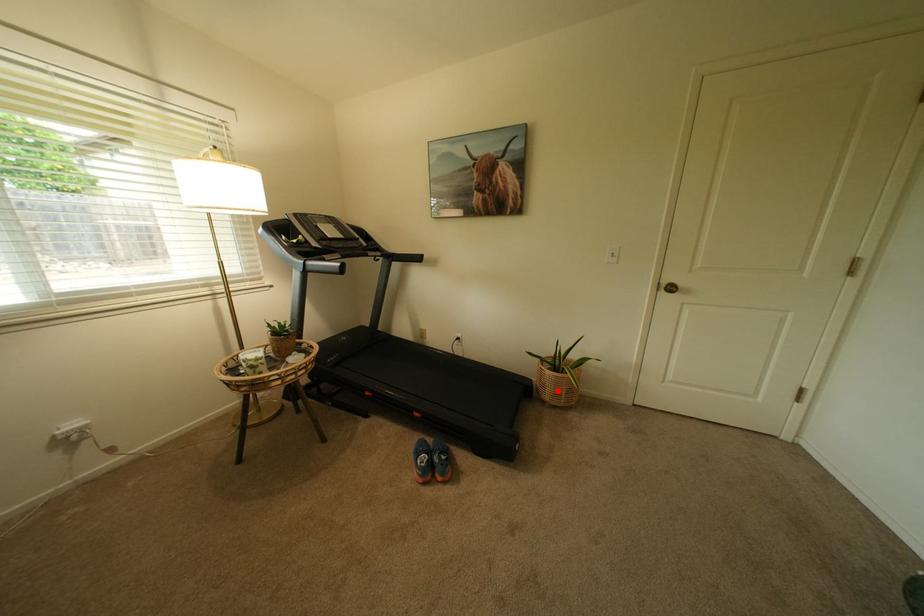
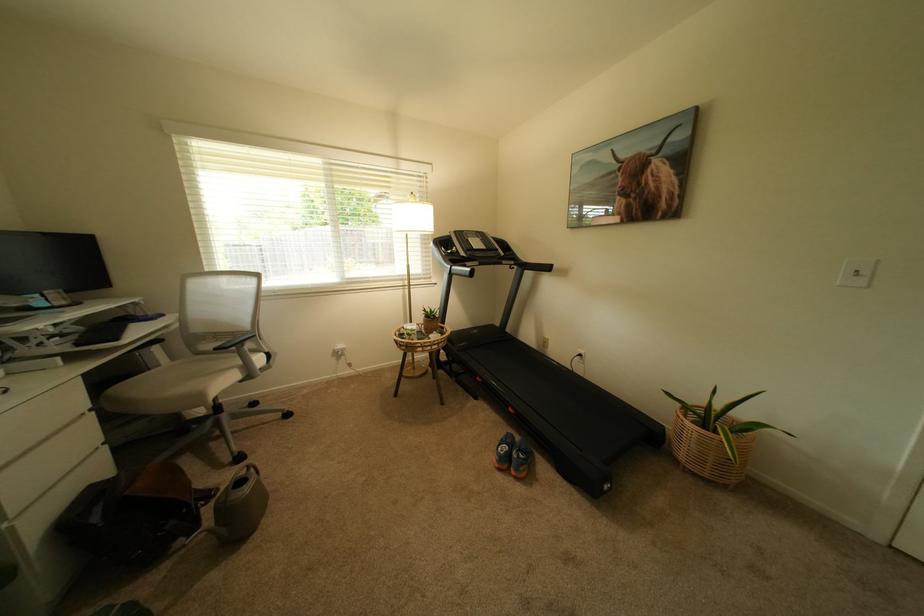
Where in the second image is the point corresponding to the highlighted location from the first image?

(695, 448)